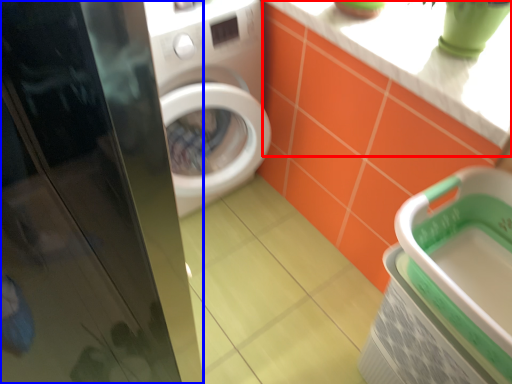
Question: Which of the following is the closest to the observer, counter top (highlighted by a red box) or screen door (highlighted by a blue box)?

Choices:
 (A) counter top
 (B) screen door

Answer: (B)